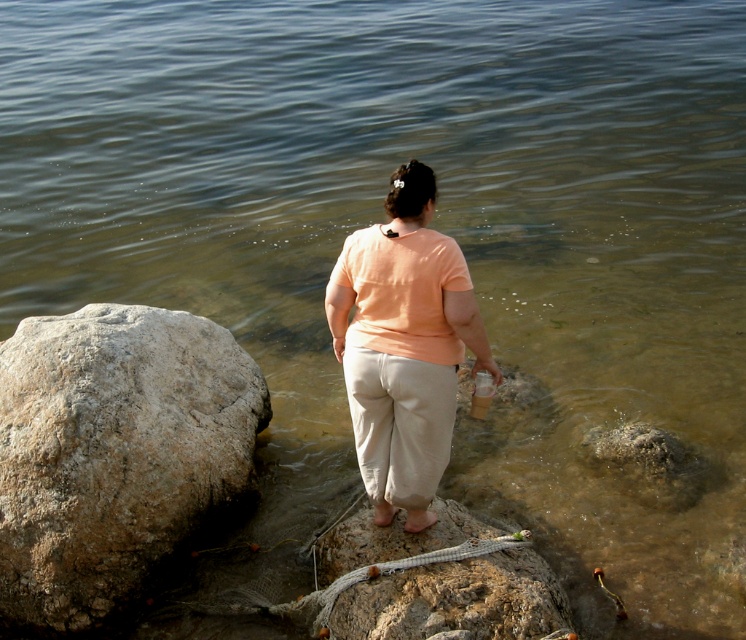
Is point (201, 490) positioned after point (480, 406)?

That is True.

Who is more forward, (113, 500) or (474, 376)?

Point (113, 500) is in front.

The image size is (746, 640). I want to click on gray rough rock at left, so click(113, 451).

Between point (56, 536) and point (363, 628), which one is positioned in front?

Point (363, 628) is in front.

Does point (37, 588) come closer to viewer compared to point (492, 632)?

That is False.

Locate an element on the screen. gray rough rock at left is located at coordinates (113, 451).

Who is lower down, matte peach shirt at center or smooth gray rock at center?

smooth gray rock at center is below.

Is matte peach shirt at center wider than smooth gray rock at center?

No.

Find the location of a particular element. The width and height of the screenshot is (746, 640). matte peach shirt at center is located at coordinates (404, 346).